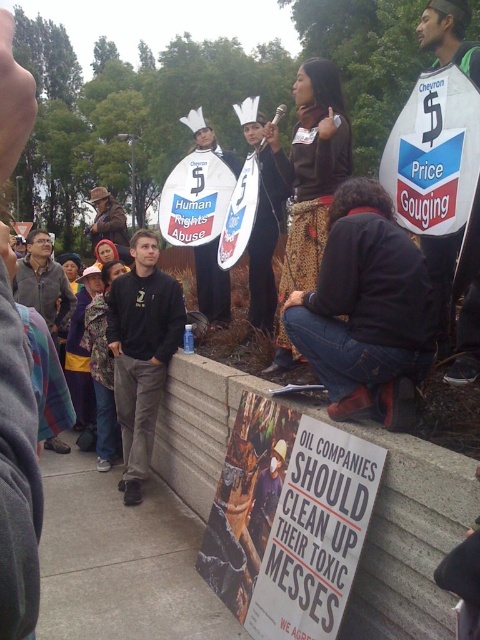
Does matte paper poster at center lie behind black cotton sweatshirt at center?

No, it is in front of black cotton sweatshirt at center.

Locate an element on the screen. The image size is (480, 640). matte paper poster at center is located at coordinates (314, 534).

Between black cotton sweatshirt at center and brown leather jacket at upper left, which one is positioned higher?

brown leather jacket at upper left

What do you see at coordinates (142, 353) in the screenshot? This screenshot has height=640, width=480. I see `black cotton sweatshirt at center` at bounding box center [142, 353].

At what (x,y) coordinates should I click in order to perform the action: click on black cotton sweatshirt at center. Please return your answer as a coordinate pair (x, y). Looking at the image, I should click on (142, 353).

Does black cotton sweatshirt at center have a larger size compared to dark gray jacket at center?

Indeed, black cotton sweatshirt at center has a larger size compared to dark gray jacket at center.

Which is more to the right, black cotton sweatshirt at center or dark gray jacket at center?

black cotton sweatshirt at center

Is point (108, 300) closer to viewer compared to point (57, 330)?

Yes, it is.

Locate an element on the screen. The width and height of the screenshot is (480, 640). black cotton sweatshirt at center is located at coordinates point(142,353).